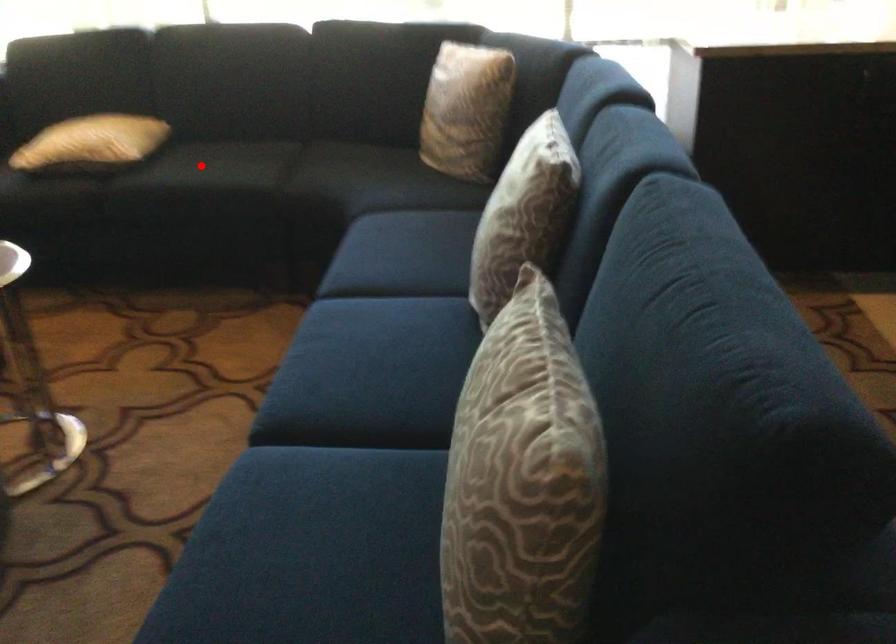
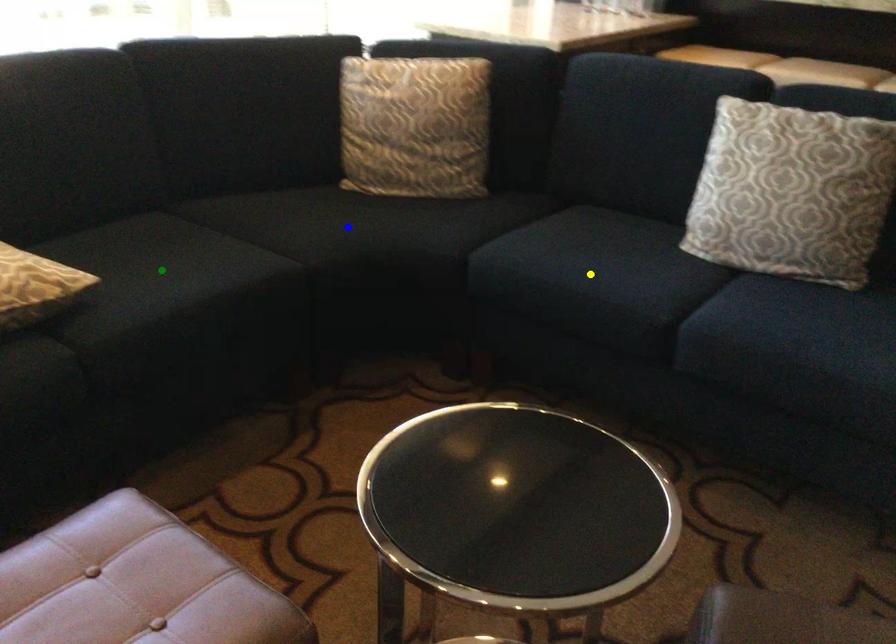
Question: I am providing you with two images of the same scene from different viewpoints. A red point is marked on the first image. You are given multiple points on the second image. Which spot in image 2 lines up with the point in image 1?

Choices:
 (A) green point
 (B) blue point
 (C) yellow point

Answer: (A)